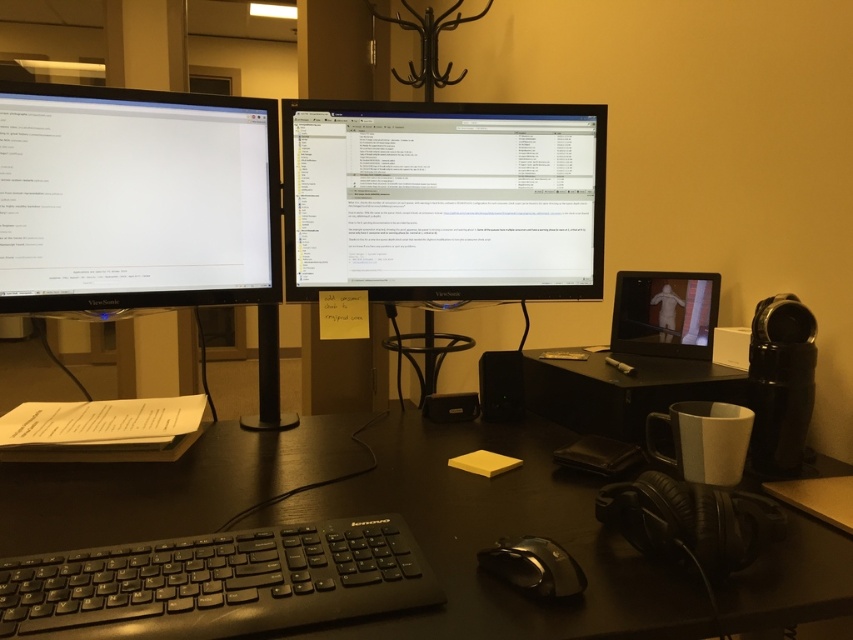
Consider the image. You are organizing items on your desk and need to place the matte black tablet at center and the black glossy mouse at center into a drawer. If the drawer can only accommodate items up to the size of the mouse, will both items fit?

The matte black tablet at center is larger than the black glossy mouse at center, so it won not fit in the drawer if the drawer can only accommodate items up to the size of the mouse.

You are a remote worker who needs to locate your black glossy monitor at center. According to the coordinates provided, where exactly should you look on the desk?

The black glossy monitor at center is located at point (444,202) on the desk.

You are setting up a new monitor stand that requires at least 10 cm of clearance below the monitor for cable management. Given the height difference between the black glossy monitor at center and the black matte keyboard at center, will the stand fit properly?

The black glossy monitor at center is much taller than the black matte keyboard at center, so there should be sufficient clearance below the monitor for the stand to fit properly as long as the stand doesn